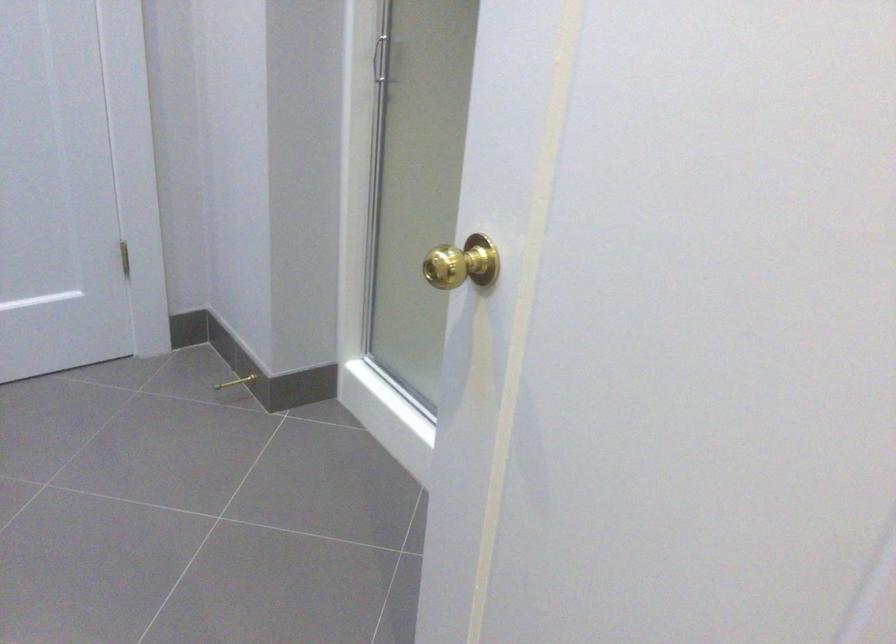
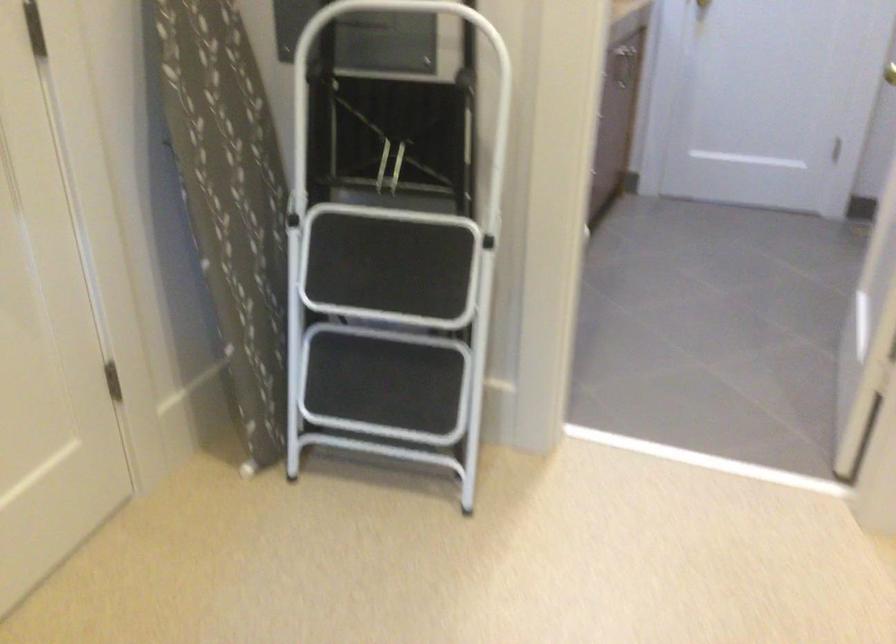
Find the pixel in the second image that matches [147,140] in the first image.

(890, 73)